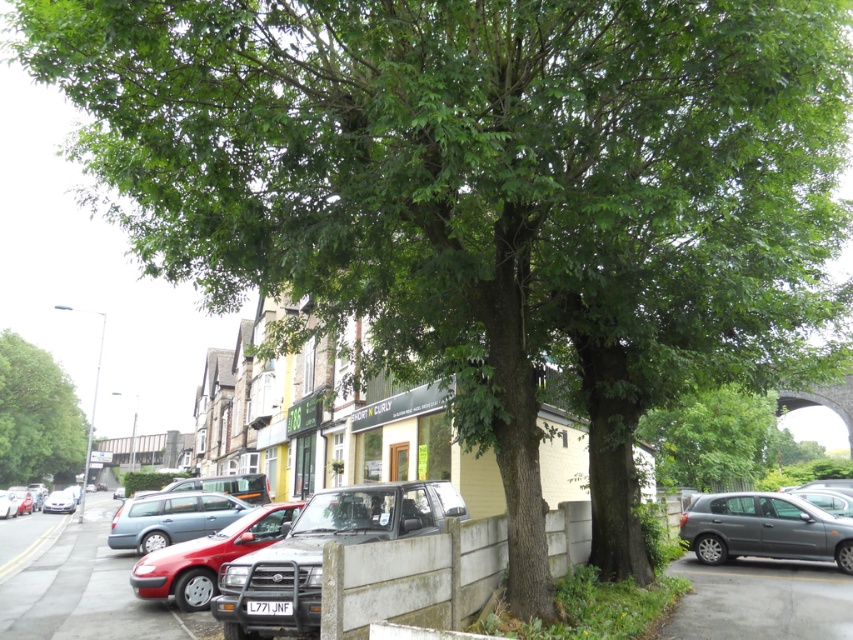
Question: Which of the following is the closest to the observer?

Choices:
 (A) (329, 500)
 (B) (730, 461)

Answer: (A)

Question: Is green leafy tree at center bigger than matte red car at center?

Choices:
 (A) no
 (B) yes

Answer: (B)

Question: Which object is the closest to the matte black suv at center?

Choices:
 (A) gray asphalt pavement at lower right
 (B) green leafy tree at left

Answer: (A)

Question: Is smooth asphalt pavement at lower left smaller than metallic gray sedan at right?

Choices:
 (A) yes
 (B) no

Answer: (B)

Question: Which of the following is the farthest from the observer?

Choices:
 (A) green leafy tree at center
 (B) matte red car at center
 (C) smooth asphalt pavement at lower left
 (D) metallic gray sedan at right

Answer: (D)

Question: In this image, where is matte red car at center located relative to matte gray station wagon at center?

Choices:
 (A) below
 (B) above

Answer: (B)